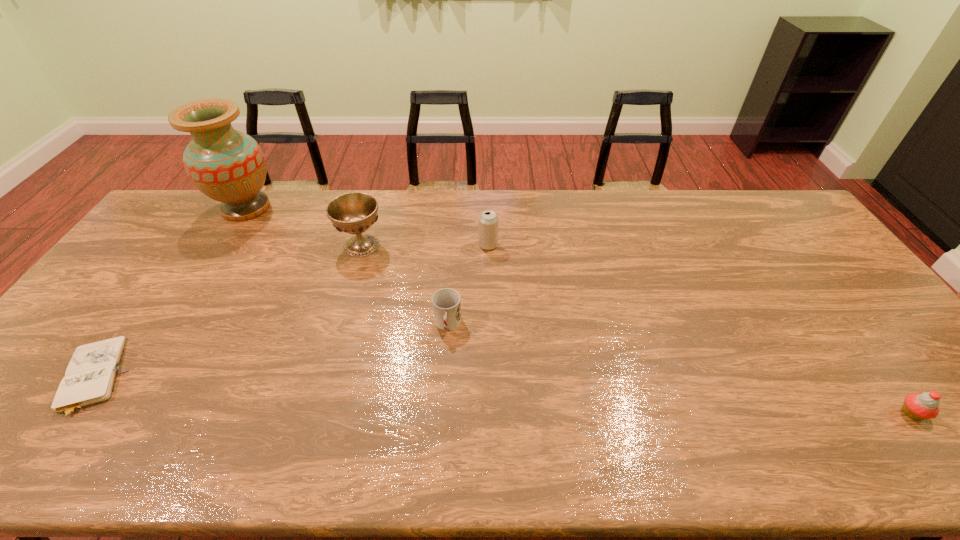
In the image, there is a desktop. In order to click on vacant space at the far edge in this screenshot , I will do `click(466, 193)`.

In the image, there is a desktop. In order to click on vacant space at the near edge in this screenshot , I will do `click(512, 451)`.

You are a GUI agent. You are given a task and a screenshot of the screen. Output one action in this format:
    pyautogui.click(x=<x>, y=<y>)
    Task: Click on the free region at the left edge of the desktop
    
    Given the screenshot: What is the action you would take?
    pyautogui.click(x=196, y=231)

This screenshot has height=540, width=960. In the image, there is a desktop. Identify the location of vacant region at the right edge. (800, 241).

In the image, there is a desktop. At what (x,y) coordinates should I click in order to perform the action: click on free space at the near left corner. Please return your answer as a coordinate pair (x, y). Looking at the image, I should click on (12, 442).

Find the location of `free space that is in between the notebook and the fourth object from left to right`. free space that is in between the notebook and the fourth object from left to right is located at coordinates (269, 351).

You are a GUI agent. You are given a task and a screenshot of the screen. Output one action in this format:
    pyautogui.click(x=<x>, y=<y>)
    Task: Click on the vacant region between the chalice and the rightmost object
    This screenshot has height=540, width=960.
    Given the screenshot: What is the action you would take?
    pyautogui.click(x=636, y=329)

Find the location of a particular element. unoccupied area between the shortest object and the third object from left to right is located at coordinates (227, 312).

At what (x,y) coordinates should I click in order to perform the action: click on vacant space that's between the rightmost object and the notebook. Please return your answer as a coordinate pair (x, y). The height and width of the screenshot is (540, 960). Looking at the image, I should click on (501, 395).

The image size is (960, 540). In order to click on empty space between the second object from right to left and the fourth object from right to left in this screenshot , I will do `click(425, 245)`.